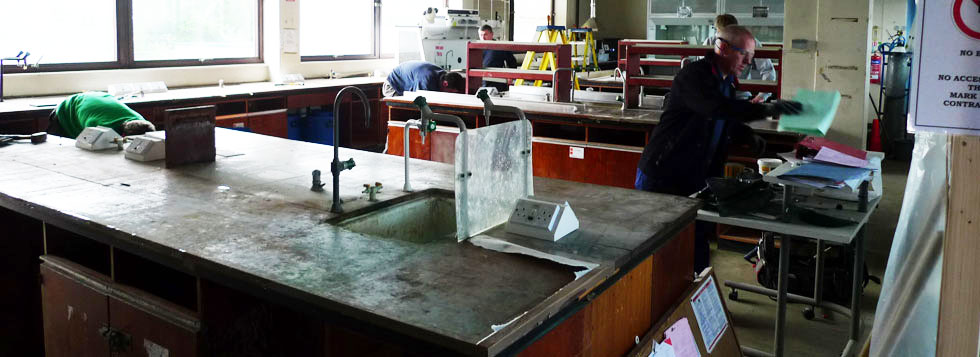
Find the location of `fume hoods`. fume hoods is located at coordinates (668, 11), (738, 10).